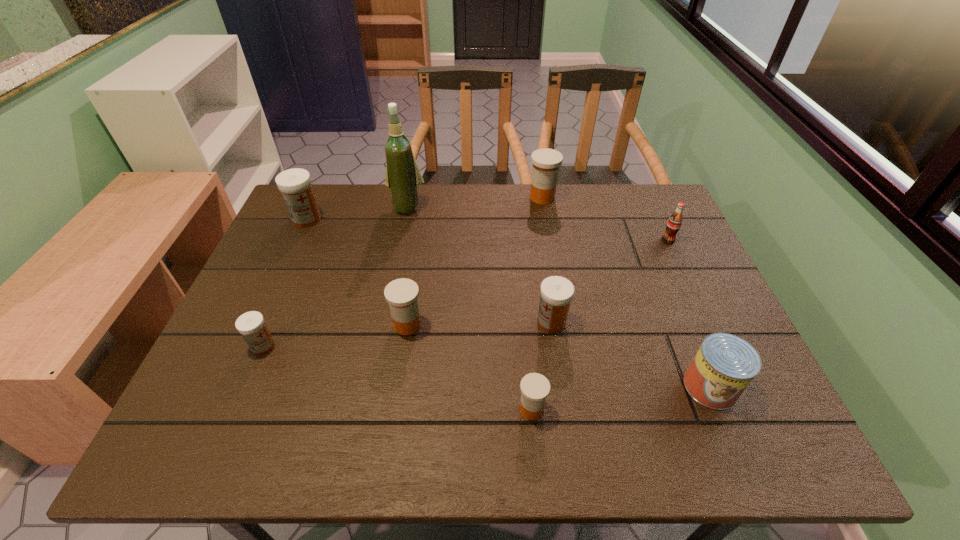
Identify the location of can. (725, 364).

Locate an element on the screen. This screenshot has width=960, height=540. the smallest white medicine is located at coordinates (251, 325).

Locate an element on the screen. This screenshot has width=960, height=540. the fifth object from left to right is located at coordinates (534, 387).

The image size is (960, 540). In order to click on the smallest orange medicine in this screenshot , I will do `click(534, 387)`.

The height and width of the screenshot is (540, 960). I want to click on free space located on the front-facing side of the wine bottle, so click(x=401, y=234).

At what (x,y) coordinates should I click in order to perform the action: click on vacant space located 0.390m on the label of the farthest orange medicine. Please return your answer as a coordinate pair (x, y). Image resolution: width=960 pixels, height=540 pixels. Looking at the image, I should click on (560, 298).

At what (x,y) coordinates should I click in order to perform the action: click on free location located on the front of the fifth nearest medicine. Please return your answer as a coordinate pair (x, y). This screenshot has width=960, height=540. Looking at the image, I should click on (260, 323).

Locate an element on the screen. The image size is (960, 540). blank space located 0.360m on the left of the sixth nearest object is located at coordinates (538, 240).

Find the location of a particular element. The image size is (960, 540). vacant area situated 0.230m on the label of the second nearest orange medicine is located at coordinates (519, 325).

This screenshot has height=540, width=960. In order to click on free spot located 0.240m on the right of the second biggest white medicine in this screenshot , I will do `click(666, 322)`.